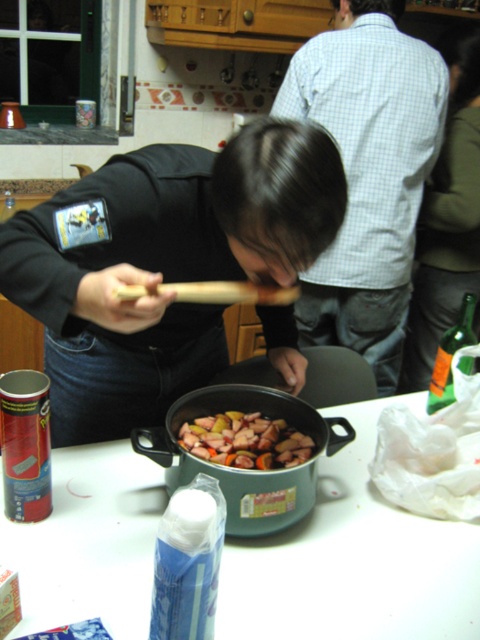
Question: Can you confirm if light blue checkered shirt at upper center is wider than green matte wok at center?

Choices:
 (A) yes
 (B) no

Answer: (A)

Question: Which object is positioned closest to the green matte wok at center?

Choices:
 (A) shiny metallic pot at center
 (B) white plastic bag at lower right
 (C) green fabric shirt at upper right

Answer: (A)

Question: Which of these objects is positioned closest to the shiny metallic pot at center?

Choices:
 (A) light blue checkered shirt at upper center
 (B) green fabric shirt at upper right
 (C) green matte wok at center

Answer: (C)

Question: Is light blue checkered shirt at upper center to the right of green matte wok at center from the viewer's perspective?

Choices:
 (A) yes
 (B) no

Answer: (A)

Question: Among these points, which one is farthest from the camera?

Choices:
 (A) (205, 419)
 (B) (336, 253)
 (C) (47, 616)

Answer: (B)

Question: Can you confirm if light blue checkered shirt at upper center is thinner than green fabric shirt at upper right?

Choices:
 (A) no
 (B) yes

Answer: (A)